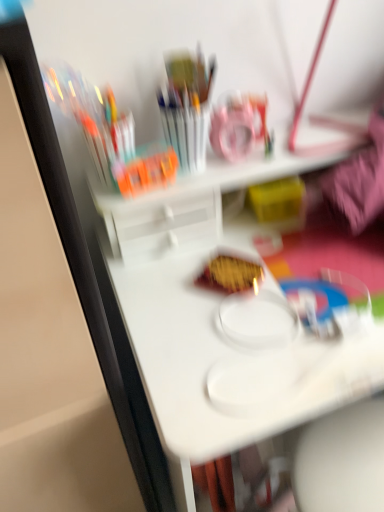
Question: Based on their sizes in the image, would you say yellow matte snack at center is bigger or smaller than white plastic table at center?

Choices:
 (A) big
 (B) small

Answer: (B)

Question: Is yellow matte snack at center taller or shorter than white plastic table at center?

Choices:
 (A) tall
 (B) short

Answer: (B)

Question: Which is correct: yellow matte snack at center is inside white plastic table at center, or outside of it?

Choices:
 (A) inside
 (B) outside

Answer: (A)

Question: Relative to yellow matte snack at center, is white plastic table at center in front or behind?

Choices:
 (A) front
 (B) behind

Answer: (A)

Question: Based on their positions, is white plastic table at center located to the left or right of yellow matte snack at center?

Choices:
 (A) left
 (B) right

Answer: (B)

Question: From a real-world perspective, is white plastic table at center physically located above or below yellow matte snack at center?

Choices:
 (A) below
 (B) above

Answer: (A)

Question: Considering the positions of point (142, 272) and point (233, 282), is point (142, 272) closer or farther from the camera than point (233, 282)?

Choices:
 (A) closer
 (B) farther

Answer: (B)